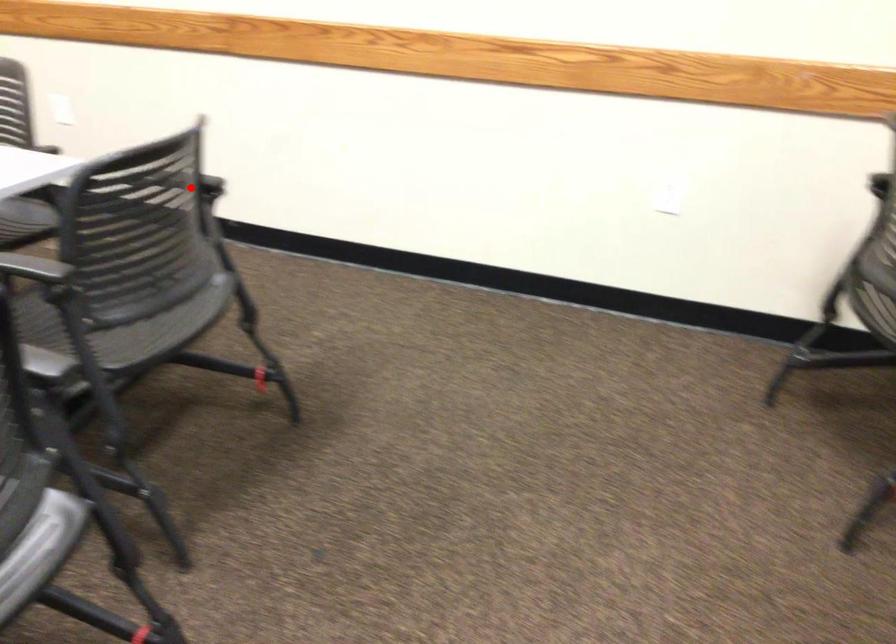
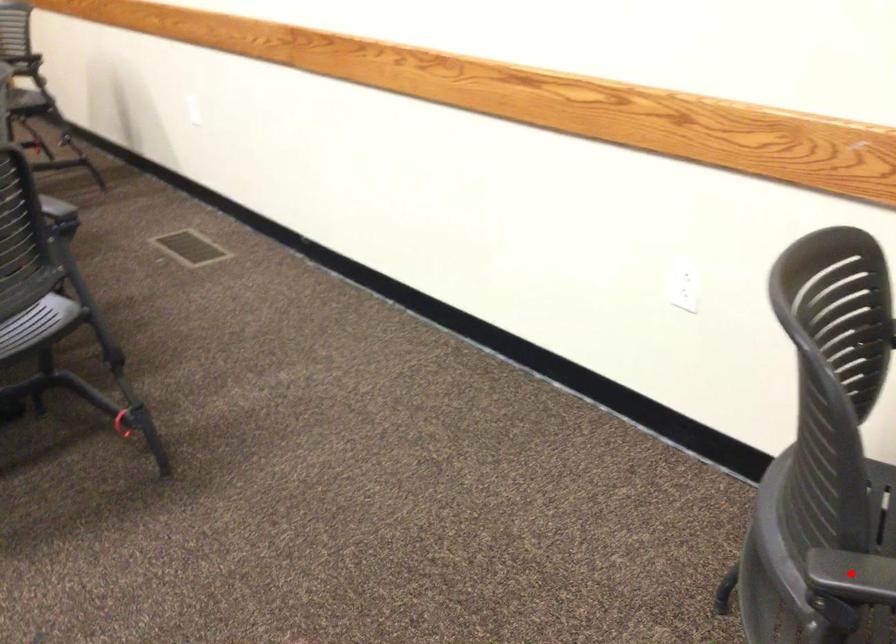
I am providing you with two images of the same scene from different viewpoints. A red point is marked on the first image and another point is marked on the second image. Does the point marked in image1 correspond to the same location as the one in image2?

No